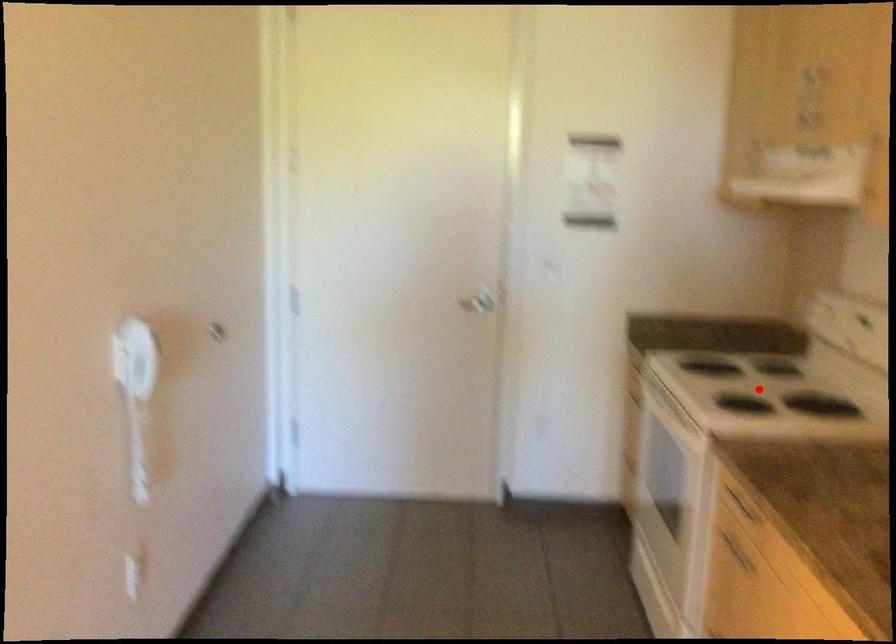
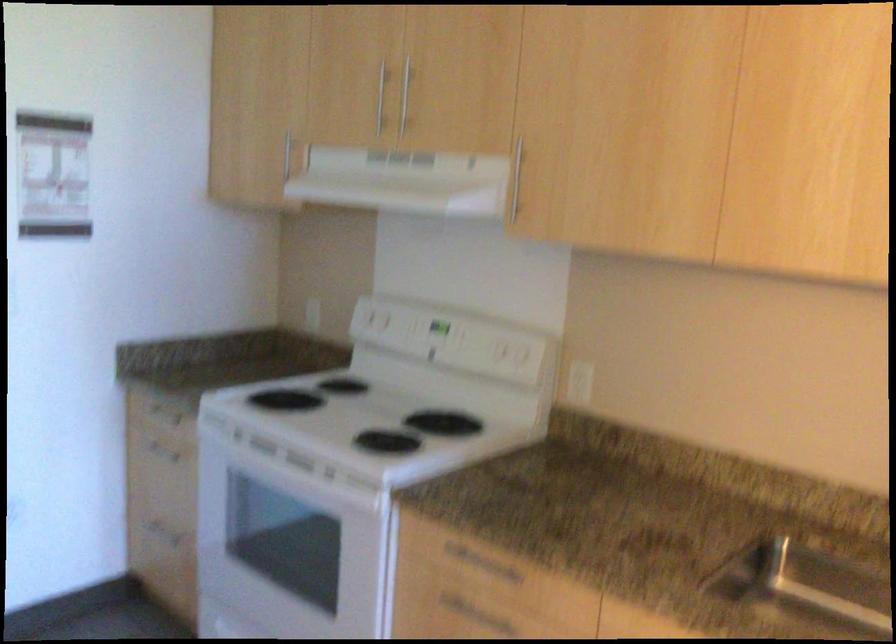
Find the pixel in the second image that matches the highlighted location in the first image.

(367, 415)